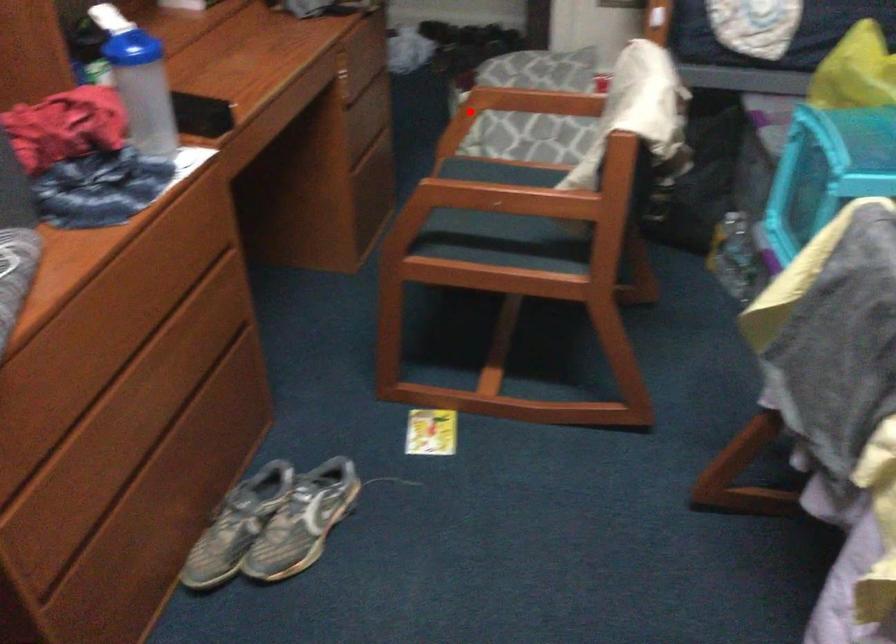
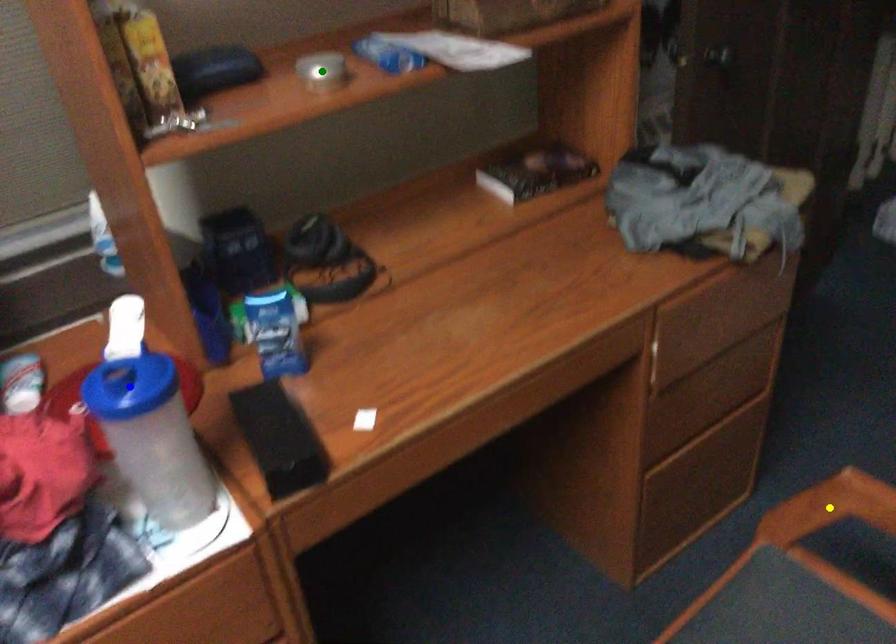
Question: I am providing you with two images of the same scene from different viewpoints. A red point is marked on the first image. You are given multiple points on the second image. Which mark in image 2 goes with the point in image 1?

Choices:
 (A) green point
 (B) yellow point
 (C) blue point

Answer: (B)